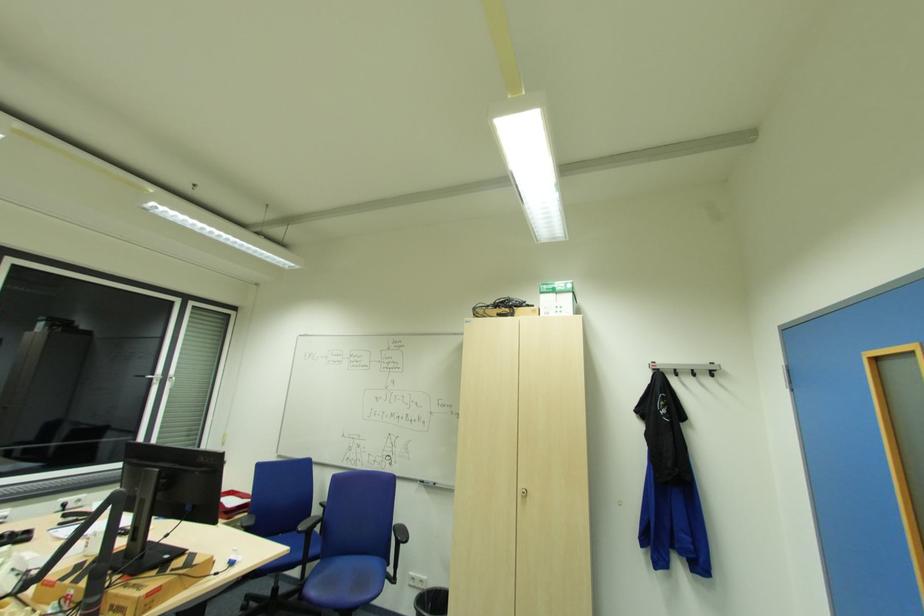
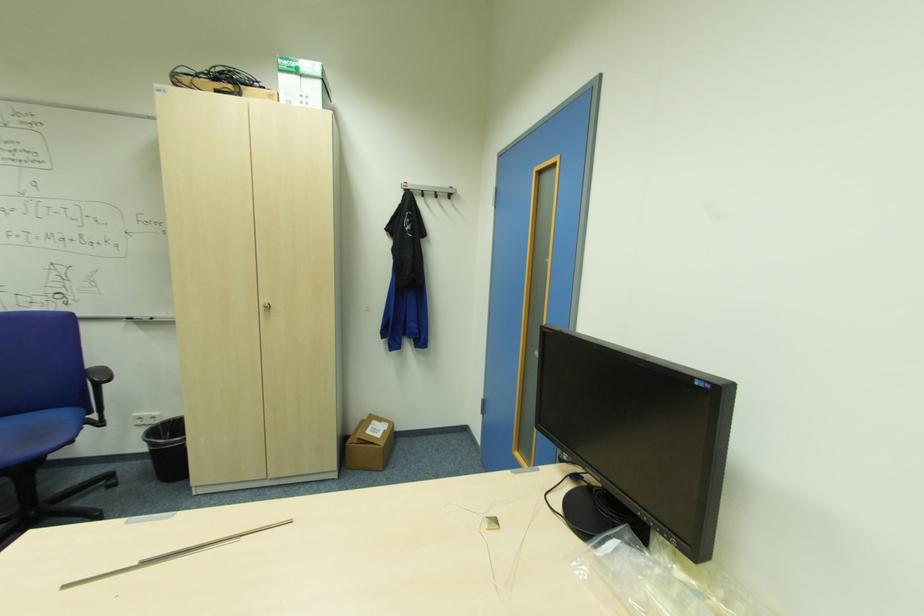
Where in the second image is the point corresponding to point (527, 493) from the first image?

(271, 307)